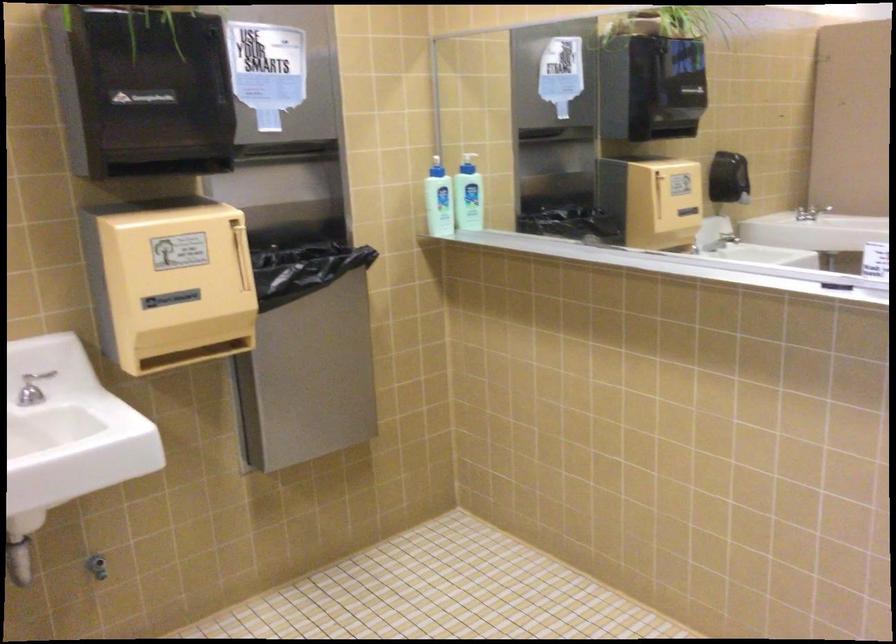
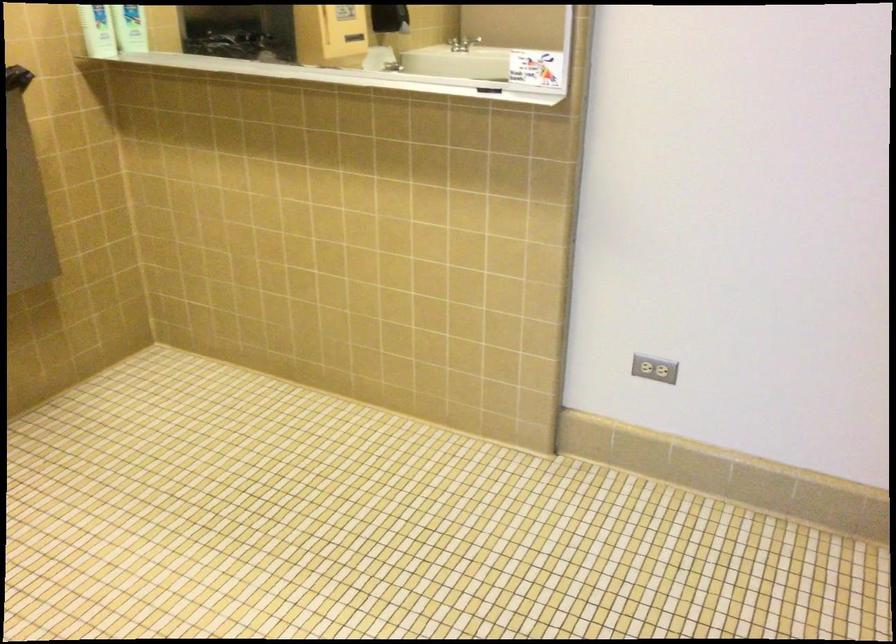
Locate, in the second image, the point that corresponds to point 442,210 in the first image.

(97, 31)